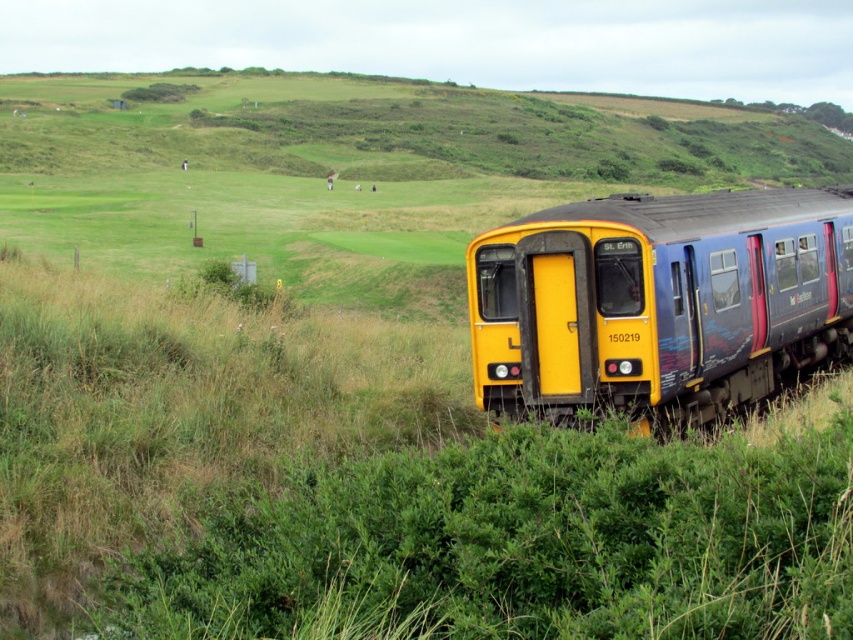
Is yellow matte train at center thinner than green grassy hillside at upper center?

Correct, yellow matte train at center's width is less than green grassy hillside at upper center's.

Is yellow matte train at center taller than green grassy hillside at upper center?

No.

Is point (701, 346) more distant than point (282, 141)?

No, (701, 346) is in front of (282, 141).

Identify the location of yellow matte train at center. (659, 301).